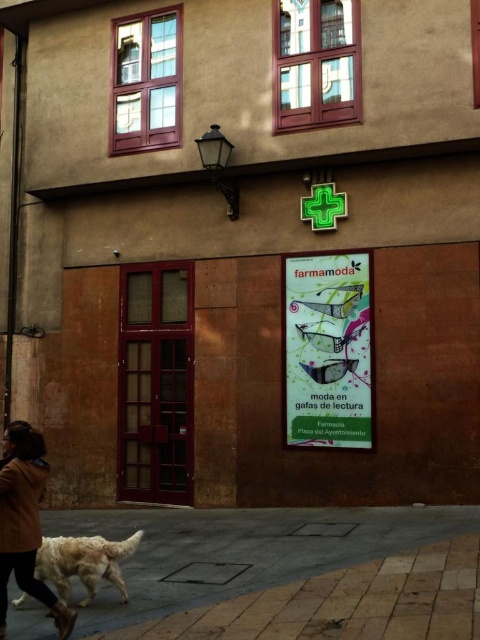
You are a delivery person trying to park your bike. The space between the matte paper poster at center and the golden fur dog at lower left is narrow. Can your bike, which is 1.2 meters wide, fit through that space?

The matte paper poster at center is narrower than the golden fur dog at lower left. However, the exact width of the space between them isn not specified in the description. Therefore, it is uncertain if the bike can fit through the space.

You are a delivery person holding a box that is 2 meters long. You need to place it on the brick pavement at lower center without overlapping the matte paper poster at center. Is this possible?

The brick pavement at lower center is 2.30 meters away from the matte paper poster at center. Since the box is 2 meters long, placing it on the brick pavement at lower center without overlapping the poster is possible as there is enough space between them.

You are a delivery person standing in front of the building. You need to attach a package to the golden fur dog at lower left. However, there is a matte paper poster at center in the way. Can you place the package directly on the dog without moving the poster?

The matte paper poster at center is located above the golden fur dog at lower left, so you can place the package directly on the golden fur dog at lower left without moving the poster since the poster is above it.